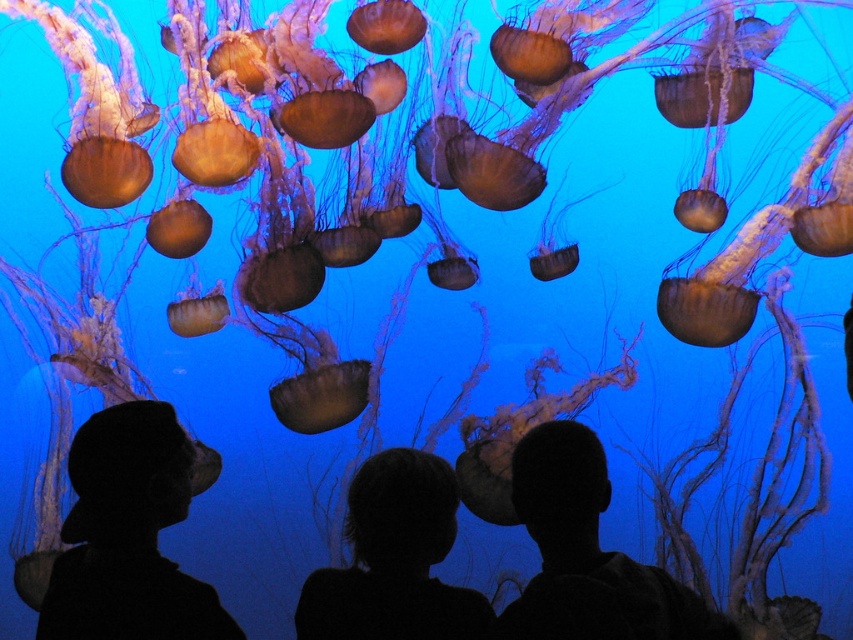
Can you confirm if silhouette hat at lower left is positioned below silhouette head at center?

Incorrect, silhouette hat at lower left is not positioned below silhouette head at center.

Is the position of silhouette hat at lower left less distant than that of silhouette head at center?

No, it is not.

What are the coordinates of `silhouette hat at lower left` in the screenshot? It's located at (128, 536).

The height and width of the screenshot is (640, 853). Identify the location of silhouette hat at lower left. (128, 536).

Can you confirm if silhouette head at center is thinner than silhouette hair at center?

No, silhouette head at center is not thinner than silhouette hair at center.

Does silhouette head at center appear over silhouette hair at center?

Yes.

At what (x,y) coordinates should I click in order to perform the action: click on silhouette head at center. Please return your answer as a coordinate pair (x, y). Image resolution: width=853 pixels, height=640 pixels. Looking at the image, I should click on (589, 554).

Does silhouette hat at lower left have a larger size compared to silhouette hair at center?

No.

Which is more to the right, silhouette hat at lower left or silhouette hair at center?

From the viewer's perspective, silhouette hair at center appears more on the right side.

Identify the location of silhouette hat at lower left. The height and width of the screenshot is (640, 853). (128, 536).